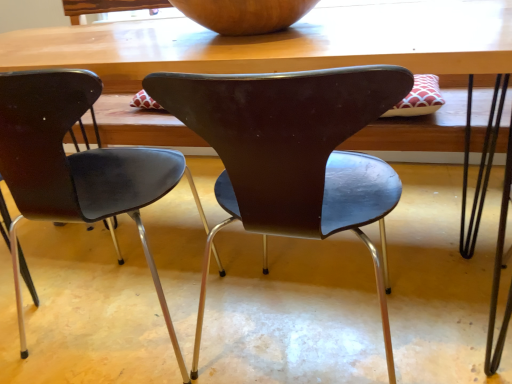
Image resolution: width=512 pixels, height=384 pixels. Describe the element at coordinates (293, 154) in the screenshot. I see `brown matte chair at center, the first chair when ordered from right to left` at that location.

How much space does matte black chair at center, which is counted as the 1th chair, starting from the left, occupy vertically?

The height of matte black chair at center, which is counted as the 1th chair, starting from the left, is 74.53 centimeters.

Where is `wooden table at center`? wooden table at center is located at coordinates (282, 43).

The image size is (512, 384). Identify the location of brown matte chair at center, the first chair when ordered from right to left. (293, 154).

Is matte black chair at center, the 2th chair in the right-to-left sequence, beside brown matte chair at center, the second chair viewed from the left?

No, matte black chair at center, the 2th chair in the right-to-left sequence, is not touching brown matte chair at center, the second chair viewed from the left.

Can you confirm if matte black chair at center, the 2th chair in the right-to-left sequence, is shorter than brown matte chair at center, the second chair viewed from the left?

No, matte black chair at center, the 2th chair in the right-to-left sequence, is not shorter than brown matte chair at center, the second chair viewed from the left.

This screenshot has height=384, width=512. Find the location of `chair below the matte black chair at center, the 2th chair in the right-to-left sequence (from a real-world perspective)`. chair below the matte black chair at center, the 2th chair in the right-to-left sequence (from a real-world perspective) is located at coordinates click(293, 154).

From the image's perspective, relative to brown matte chair at center, the second chair viewed from the left, is matte black chair at center, which is counted as the 1th chair, starting from the left, above or below?

Based on their image positions, matte black chair at center, which is counted as the 1th chair, starting from the left, is located above brown matte chair at center, the second chair viewed from the left.

Does brown matte chair at center, the first chair when ordered from right to left, have a lesser height compared to matte black chair at center, which is counted as the 1th chair, starting from the left?

Indeed, brown matte chair at center, the first chair when ordered from right to left, has a lesser height compared to matte black chair at center, which is counted as the 1th chair, starting from the left.

Identify the location of chair above the brown matte chair at center, the first chair when ordered from right to left (from the image's perspective). This screenshot has width=512, height=384. 77,168.

From a real-world perspective, does brown matte chair at center, the second chair viewed from the left, sit lower than matte black chair at center, which is counted as the 1th chair, starting from the left?

Correct, in the physical world, brown matte chair at center, the second chair viewed from the left, is lower than matte black chair at center, which is counted as the 1th chair, starting from the left.

From the image's perspective, is brown matte chair at center, the second chair viewed from the left, located beneath matte black chair at center, the 2th chair in the right-to-left sequence?

Correct, brown matte chair at center, the second chair viewed from the left, appears lower than matte black chair at center, the 2th chair in the right-to-left sequence, in the image.

Looking at this image, which object is positioned more to the left, wooden table at center or matte black chair at center, which is counted as the 1th chair, starting from the left?

From the viewer's perspective, matte black chair at center, which is counted as the 1th chair, starting from the left, appears more on the left side.

From the image's perspective, is wooden table at center on matte black chair at center, which is counted as the 1th chair, starting from the left?

Yes, from the image's perspective, wooden table at center is above matte black chair at center, which is counted as the 1th chair, starting from the left.

Are wooden table at center and matte black chair at center, the 2th chair in the right-to-left sequence, making contact?

No, wooden table at center is not beside matte black chair at center, the 2th chair in the right-to-left sequence.

The height and width of the screenshot is (384, 512). Identify the location of table on the right of matte black chair at center, the 2th chair in the right-to-left sequence. (282, 43).

Between matte black chair at center, which is counted as the 1th chair, starting from the left, and wooden bowl at upper center, which one appears on the right side from the viewer's perspective?

Positioned to the right is wooden bowl at upper center.

From the image's perspective, between matte black chair at center, which is counted as the 1th chair, starting from the left, and wooden bowl at upper center, which one is located above?

wooden bowl at upper center.

Looking at this image, considering the relative sizes of matte black chair at center, the 2th chair in the right-to-left sequence, and wooden bowl at upper center in the image provided, is matte black chair at center, the 2th chair in the right-to-left sequence, smaller than wooden bowl at upper center?

Actually, matte black chair at center, the 2th chair in the right-to-left sequence, might be larger than wooden bowl at upper center.

Is wooden table at center positioned with its back to brown matte chair at center, the first chair when ordered from right to left?

Yes, brown matte chair at center, the first chair when ordered from right to left, is at the back of wooden table at center.

Is wooden table at center in front of or behind brown matte chair at center, the second chair viewed from the left, in the image?

Clearly, wooden table at center is in front of brown matte chair at center, the second chair viewed from the left.

Considering the positions of objects wooden table at center and brown matte chair at center, the second chair viewed from the left, in the image provided, who is more to the right, wooden table at center or brown matte chair at center, the second chair viewed from the left,?

Positioned to the right is brown matte chair at center, the second chair viewed from the left.

Can you see wooden table at center touching brown matte chair at center, the second chair viewed from the left?

No, wooden table at center is not making contact with brown matte chair at center, the second chair viewed from the left.

How different are the orientations of wooden bowl at upper center and wooden table at center in degrees?

wooden bowl at upper center and wooden table at center are facing 3.6 degrees away from each other.

From a real-world perspective, is wooden bowl at upper center above or below wooden table at center?

From a real-world perspective, wooden bowl at upper center is physically above wooden table at center.

Who is smaller, wooden bowl at upper center or wooden table at center?

wooden bowl at upper center is smaller.

Considering the relative sizes of wooden bowl at upper center and wooden table at center in the image provided, is wooden bowl at upper center thinner than wooden table at center?

Correct, the width of wooden bowl at upper center is less than that of wooden table at center.

Could you tell me if matte black chair at center, which is counted as the 1th chair, starting from the left, is facing wooden table at center?

Yes, matte black chair at center, which is counted as the 1th chair, starting from the left, faces towards wooden table at center.

From the image's perspective, relative to wooden table at center, is matte black chair at center, the 2th chair in the right-to-left sequence, above or below?

From the image's perspective, matte black chair at center, the 2th chair in the right-to-left sequence, appears below wooden table at center.

In the image, there is a matte black chair at center, the 2th chair in the right-to-left sequence. Identify the location of chair below it (from a real-world perspective). (293, 154).

The image size is (512, 384). I want to click on chair above the brown matte chair at center, the second chair viewed from the left (from a real-world perspective), so click(77, 168).

From the image, which object appears to be farther from matte black chair at center, which is counted as the 1th chair, starting from the left, wooden table at center or brown matte chair at center, the first chair when ordered from right to left?

wooden table at center is further to matte black chair at center, which is counted as the 1th chair, starting from the left.

Looking at the image, which one is located closer to wooden table at center, brown matte chair at center, the first chair when ordered from right to left, or wooden bowl at upper center?

wooden bowl at upper center lies closer to wooden table at center than the other object.

Estimate the real-world distances between objects in this image. Which object is closer to brown matte chair at center, the second chair viewed from the left, wooden bowl at upper center or wooden table at center?

wooden table at center is positioned closer to the anchor brown matte chair at center, the second chair viewed from the left.

Considering their positions, is brown matte chair at center, the first chair when ordered from right to left, positioned closer to wooden table at center than matte black chair at center, the 2th chair in the right-to-left sequence?

brown matte chair at center, the first chair when ordered from right to left, is closer to wooden table at center.

Based on their spatial positions, is wooden table at center or wooden bowl at upper center further from matte black chair at center, the 2th chair in the right-to-left sequence?

The object further to matte black chair at center, the 2th chair in the right-to-left sequence, is wooden bowl at upper center.

When comparing their distances from wooden bowl at upper center, does brown matte chair at center, the second chair viewed from the left, or wooden table at center seem further?

brown matte chair at center, the second chair viewed from the left, is positioned further to the anchor wooden bowl at upper center.

Which object lies nearer to the anchor point wooden bowl at upper center, matte black chair at center, the 2th chair in the right-to-left sequence, or wooden table at center?

wooden table at center.

Which object lies nearer to the anchor point brown matte chair at center, the first chair when ordered from right to left, matte black chair at center, the 2th chair in the right-to-left sequence, or wooden table at center?

wooden table at center is closer to brown matte chair at center, the first chair when ordered from right to left.

Where is `table between wooden bowl at upper center and brown matte chair at center, the first chair when ordered from right to left, vertically`? The width and height of the screenshot is (512, 384). table between wooden bowl at upper center and brown matte chair at center, the first chair when ordered from right to left, vertically is located at coordinates (282, 43).

The image size is (512, 384). I want to click on chair between wooden bowl at upper center and brown matte chair at center, the first chair when ordered from right to left, from top to bottom, so click(77, 168).

I want to click on table between wooden bowl at upper center and matte black chair at center, which is counted as the 1th chair, starting from the left, in the up-down direction, so click(282, 43).

This screenshot has height=384, width=512. I want to click on table between matte black chair at center, the 2th chair in the right-to-left sequence, and brown matte chair at center, the first chair when ordered from right to left, in the horizontal direction, so click(x=282, y=43).